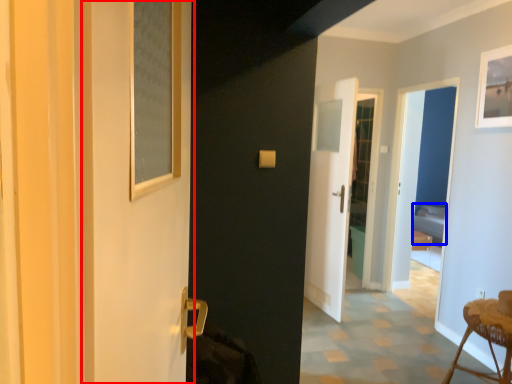
Question: Which point is closer to the camera, screen door (highlighted by a red box) or bed (highlighted by a blue box)?

Choices:
 (A) screen door
 (B) bed

Answer: (A)